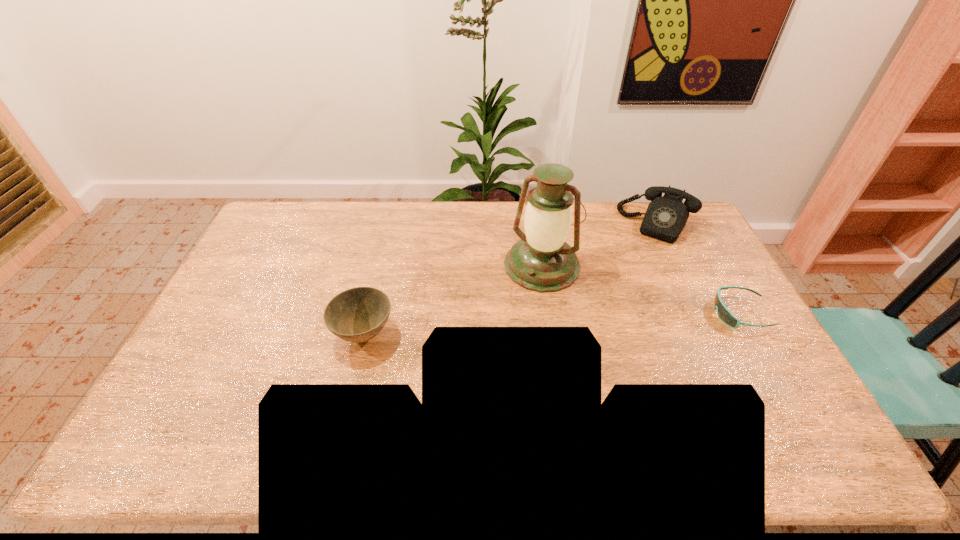
The image size is (960, 540). I want to click on unoccupied area between the telephone and the sunglasses, so click(x=699, y=268).

Identify the location of free spot between the leftmost object and the lantern. The height and width of the screenshot is (540, 960). (453, 300).

Where is `vacant area that lies between the second object from left to right and the third tallest object`? vacant area that lies between the second object from left to right and the third tallest object is located at coordinates (453, 300).

Image resolution: width=960 pixels, height=540 pixels. Identify the location of free spot between the third shortest object and the tallest object. (600, 245).

Identify the location of object that is the second closest to the sunglasses. (541, 261).

The height and width of the screenshot is (540, 960). I want to click on the second closest object to the bowl, so click(x=666, y=216).

The width and height of the screenshot is (960, 540). Find the location of `free space in the image that satisfies the following two spatial constraints: 1. on the back side of the third object from right to left; 2. on the left side of the bowl`. free space in the image that satisfies the following two spatial constraints: 1. on the back side of the third object from right to left; 2. on the left side of the bowl is located at coordinates (x=381, y=265).

At what (x,y) coordinates should I click in order to perform the action: click on free space that satisfies the following two spatial constraints: 1. on the front side of the sunglasses; 2. on the front-facing side of the telephone. Please return your answer as a coordinate pair (x, y). The height and width of the screenshot is (540, 960). Looking at the image, I should click on (701, 313).